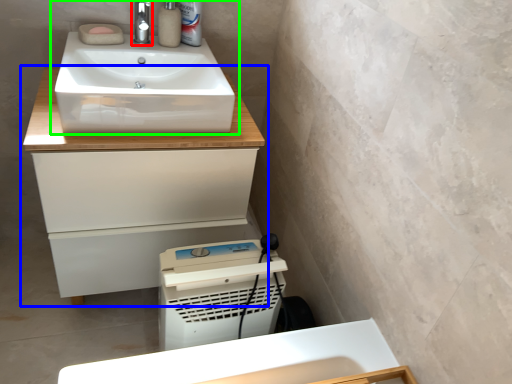
Question: Which object is the closest to the tap (highlighted by a red box)? Choose among these: bathroom cabinet (highlighted by a blue box) or sink (highlighted by a green box).

Choices:
 (A) bathroom cabinet
 (B) sink

Answer: (B)